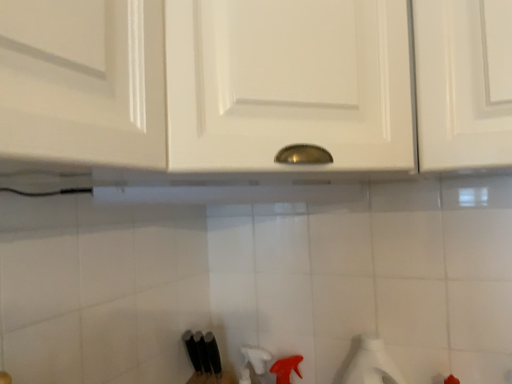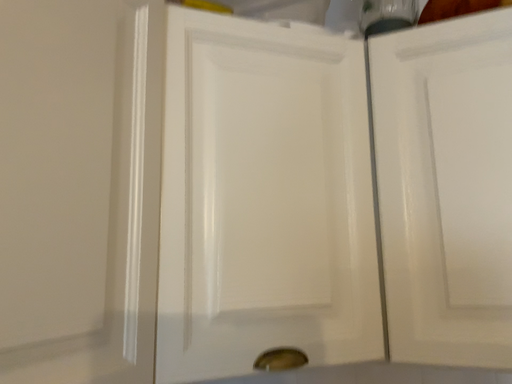
Question: Which way did the camera rotate in the video?

Choices:
 (A) rotated downward
 (B) rotated upward

Answer: (B)